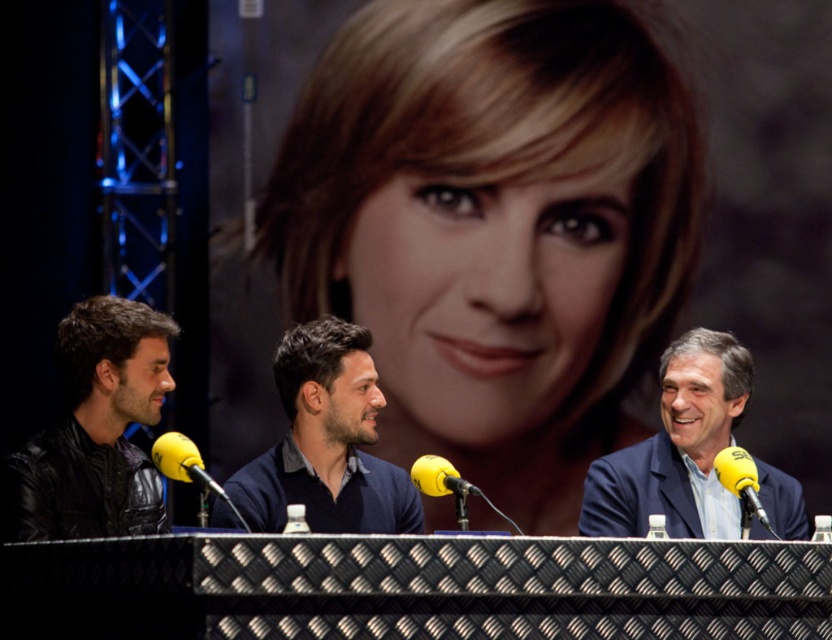
Can you confirm if dark blue sweater at center is bigger than yellow foam microphone at right?

Indeed, dark blue sweater at center has a larger size compared to yellow foam microphone at right.

The height and width of the screenshot is (640, 832). Describe the element at coordinates (325, 442) in the screenshot. I see `dark blue sweater at center` at that location.

This screenshot has height=640, width=832. What do you see at coordinates (325, 442) in the screenshot?
I see `dark blue sweater at center` at bounding box center [325, 442].

What are the coordinates of `dark blue sweater at center` in the screenshot? It's located at (325, 442).

How much distance is there between blue fabric suit at right and yellow foam microphone at right?

blue fabric suit at right and yellow foam microphone at right are 52.00 centimeters apart.

Is point (627, 496) more distant than point (739, 484)?

Yes, point (627, 496) is behind point (739, 484).

Locate an element on the screen. The width and height of the screenshot is (832, 640). blue fabric suit at right is located at coordinates (677, 449).

Identify the location of blue fabric suit at right. (677, 449).

Is yellow foam microphone at center positioned before yellow foam microphone at right?

No, it is behind yellow foam microphone at right.

Which of these two, yellow foam microphone at center or yellow foam microphone at right, stands taller?

Standing taller between the two is yellow foam microphone at center.

Which is behind, point (191, 465) or point (740, 452)?

The point (740, 452) is more distant.

The height and width of the screenshot is (640, 832). In order to click on yellow foam microphone at center in this screenshot , I will do `click(189, 470)`.